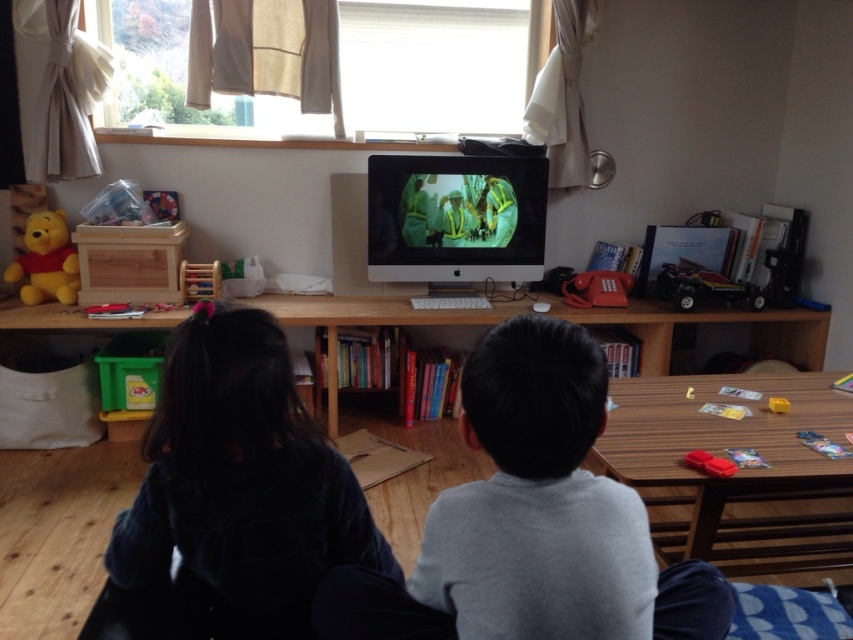
Between dark blue velvet at lower left and wooden table at lower center, which one has more height?

With more height is wooden table at lower center.

Between dark blue velvet at lower left and wooden table at lower center, which one appears on the left side from the viewer's perspective?

dark blue velvet at lower left is more to the left.

Where is `dark blue velvet at lower left`? dark blue velvet at lower left is located at coordinates (239, 488).

The height and width of the screenshot is (640, 853). I want to click on dark blue velvet at lower left, so click(239, 488).

This screenshot has height=640, width=853. What do you see at coordinates (737, 474) in the screenshot?
I see `wooden table at lower center` at bounding box center [737, 474].

Who is lower down, wooden table at lower center or matte yellow plush bear at left?

Positioned lower is wooden table at lower center.

Is point (659, 378) closer to viewer compared to point (61, 244)?

Yes.

I want to click on wooden table at lower center, so click(x=737, y=474).

Who is positioned more to the right, matte yellow plush bear at left or black plastic toy car at right?

black plastic toy car at right

Who is more forward, (53, 227) or (689, 285)?

Point (53, 227) is in front.

I want to click on matte yellow plush bear at left, so click(x=45, y=260).